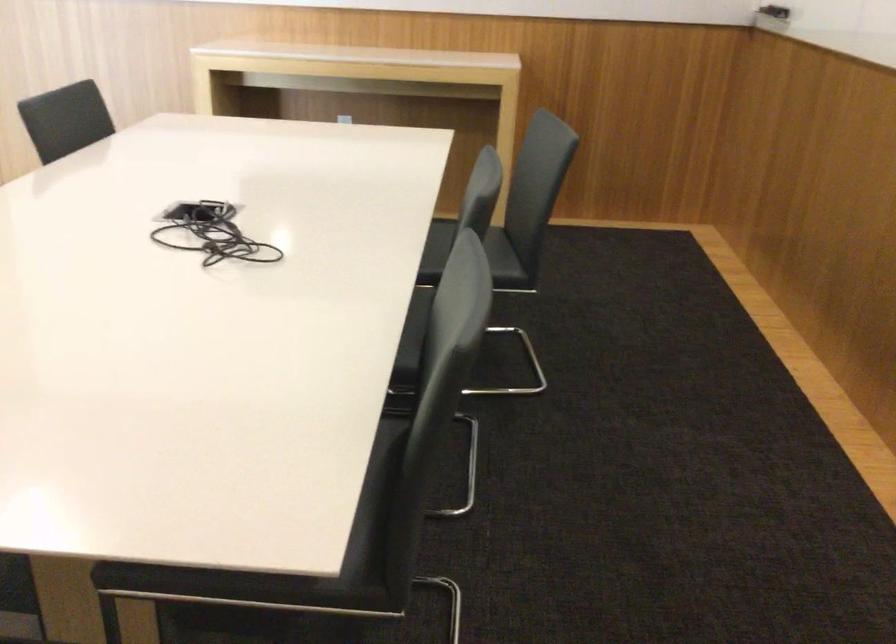
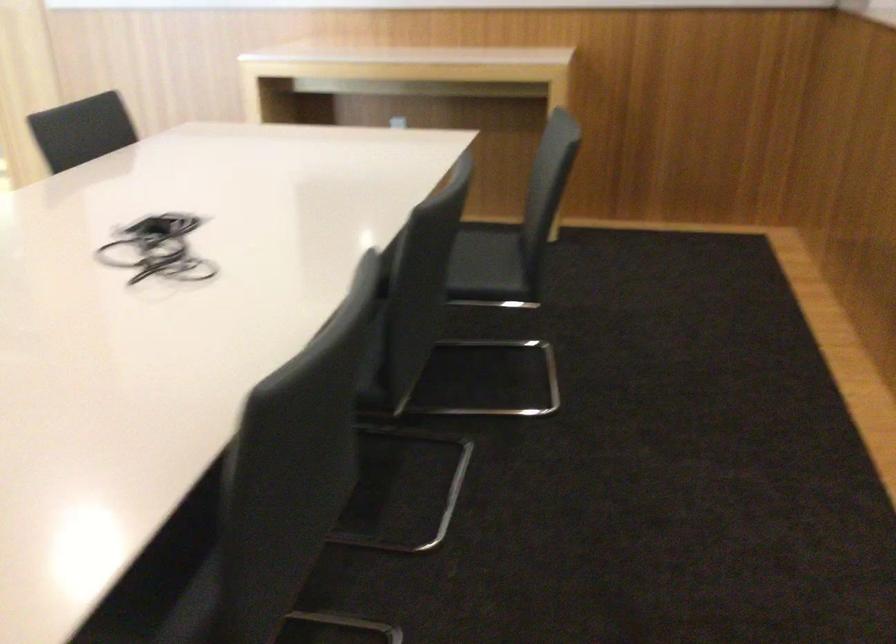
Question: I am providing you with two images of the same scene from different viewpoints. Please identify which objects are invisible in image2.

Choices:
 (A) white flush plate
 (B) chair sitting surface
 (C) grey chair sitting surface
 (D) tangled black wires

Answer: (C)